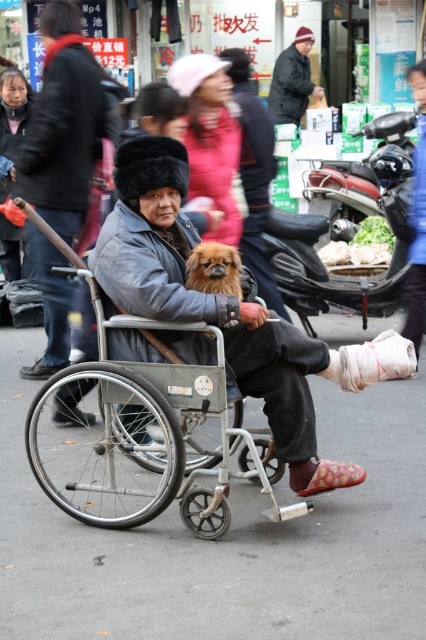
Who is more forward, (143, 371) or (201, 268)?

Point (143, 371) is more forward.

Between metallic gray wheelchair at center and fluffy brown dog at center, which one has more height?

With more height is metallic gray wheelchair at center.

Measure the distance between point [210,403] and camera.

They are 4.34 meters apart.

The width and height of the screenshot is (426, 640). Find the location of `metallic gray wheelchair at center`. metallic gray wheelchair at center is located at coordinates (143, 444).

Does gray woolen jacket at center have a greater height compared to metallic red motorcycle at right?

Yes.

Does gray woolen jacket at center have a lesser height compared to metallic red motorcycle at right?

No, gray woolen jacket at center is not shorter than metallic red motorcycle at right.

Which is behind, point (259, 349) or point (397, 128)?

The point (397, 128) is more distant.

Find the location of `gray woolen jacket at center`. gray woolen jacket at center is located at coordinates (226, 310).

Is dark gray fabric coat at center shorter than fluffy brown dog at center?

No.

Where is `dark gray fabric coat at center`? dark gray fabric coat at center is located at coordinates (65, 124).